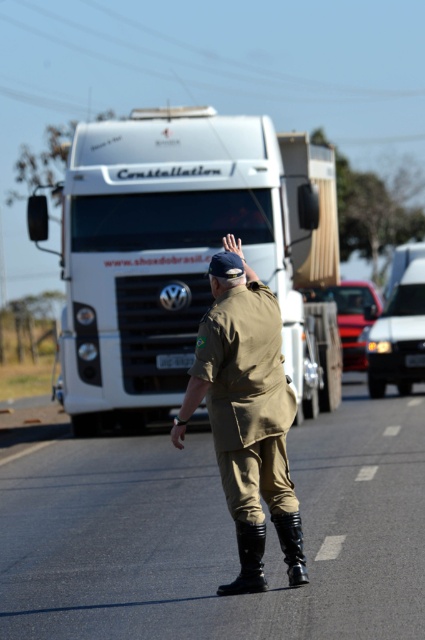
Question: Is white glossy truck at center to the left of khaki uniform at center from the viewer's perspective?

Choices:
 (A) yes
 (B) no

Answer: (A)

Question: Which object is positioned closest to the black rubber boots at center?

Choices:
 (A) khaki uniform at center
 (B) black leather boot at center
 (C) black leather boot at lower center
 (D) white glossy truck at center

Answer: (C)

Question: Which point appears farthest from the camera in this image?

Choices:
 (A) (76, 209)
 (B) (289, 561)
 (C) (277, 307)

Answer: (A)

Question: Does white glossy truck at center come in front of khaki uniform at center?

Choices:
 (A) no
 (B) yes

Answer: (A)

Question: Which point is closer to the camera taking this photo?

Choices:
 (A) (257, 570)
 (B) (316, 371)
 (C) (221, 586)

Answer: (A)

Question: Where is white glossy truck at center located in relation to black leather boot at lower center in the image?

Choices:
 (A) below
 (B) above

Answer: (B)